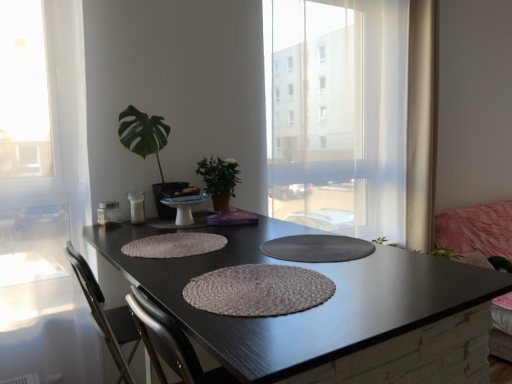
The height and width of the screenshot is (384, 512). What are the coordinates of `vacant space in front of rustic woven placemat at center, which is the second wide from back to front` in the screenshot? It's located at (283, 330).